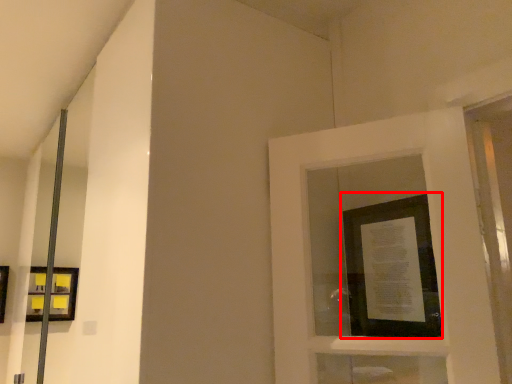
Question: From the image's perspective, where is picture frame (annotated by the red box) located relative to picture frame?

Choices:
 (A) above
 (B) below

Answer: (A)